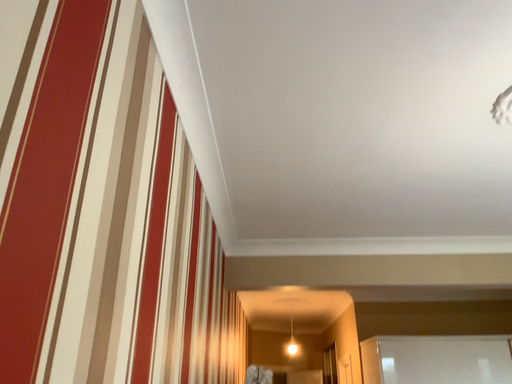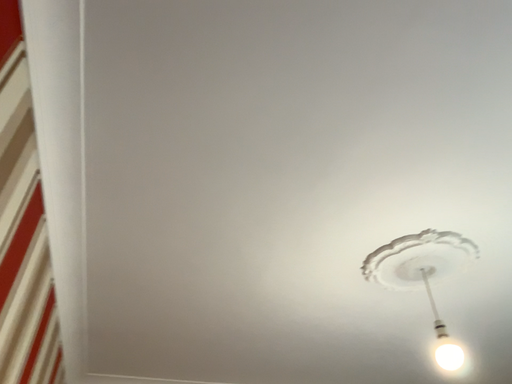
Question: How did the camera likely rotate when shooting the video?

Choices:
 (A) rotated right
 (B) rotated left

Answer: (A)